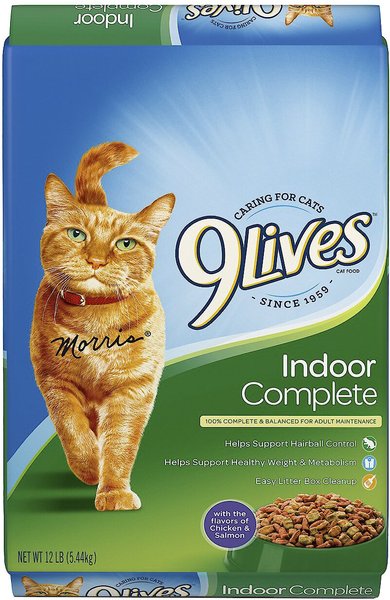
Locate an element on the screen. The height and width of the screenshot is (600, 390). indoor is located at coordinates (236, 589).